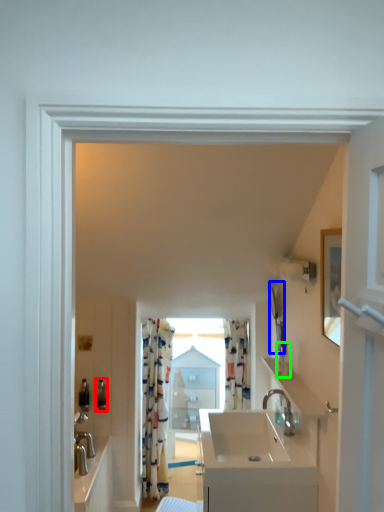
Question: Estimate the real-world distances between objects in this image. Which object is closer to toiletry (highlighted by a red box), mirror (highlighted by a blue box) or toiletry (highlighted by a green box)?

Choices:
 (A) mirror
 (B) toiletry

Answer: (A)